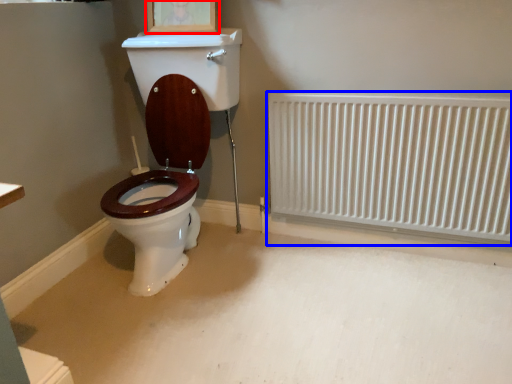
Question: Which object appears farthest to the camera in this image, picture frame (highlighted by a red box) or radiator (highlighted by a blue box)?

Choices:
 (A) picture frame
 (B) radiator

Answer: (A)